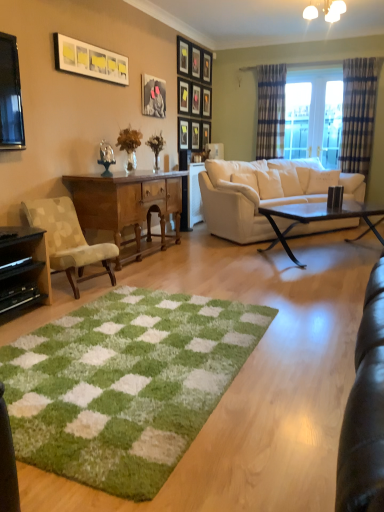
Locate an element on the screen. vacant area located to the right-hand side of green shaggy rug at center is located at coordinates (301, 343).